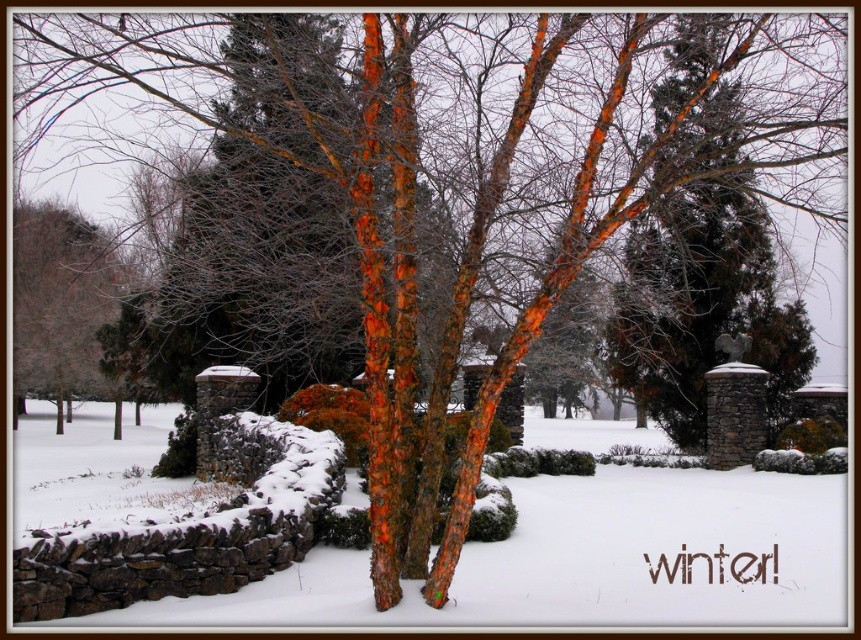
You are planning to build a snowman using the white powdery snow at center and the brown bark tree at left as reference points. Which material would you choose and why?

The white powdery snow at center is wider than the brown bark tree at left, so it would provide more material for building a snowman.

You are standing at the edge of the snowy landscape and see the point marked as point [584,557]. What does this point represent in the scene?

The point [584,557] represents the white powdery snow at center.

You are standing in the winter scene and want to place a small snowman exactly where the white powdery snow at center is. However, there is a brown bark tree at left nearby. Based on their positions, will the snowman be under the tree or in front of it?

The white powdery snow at center is located below the brown bark tree at left, so placing the snowman there would position it under the tree.